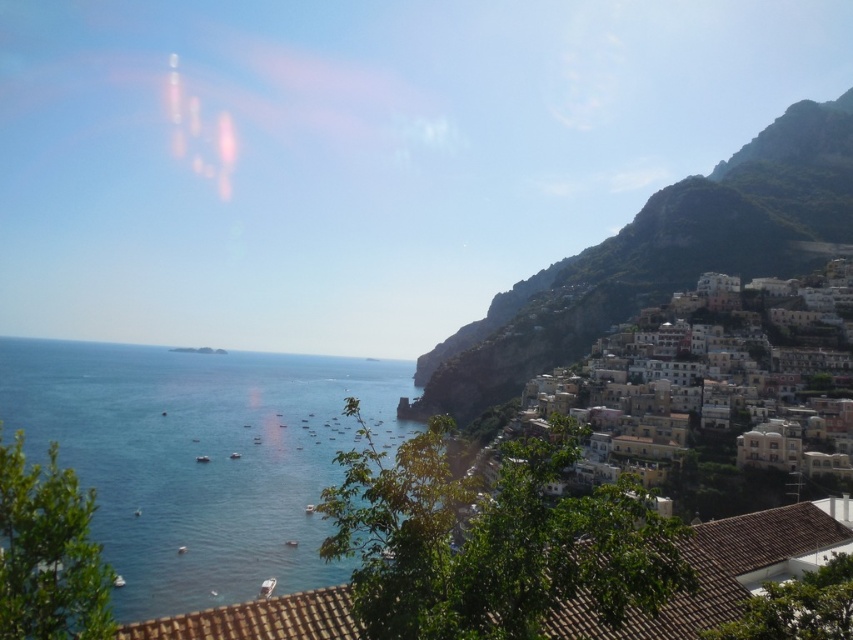
You are standing at the top of the cliff overlooking the coastal town. You see the blue water at center and the white stucco buildings at right. Which one appears closer to you in the scene?

The white stucco buildings at right appear closer because they are taller than the blue water at center in the scene.

You are standing on a cliff overlooking the coastal town and sea. You notice two points in the scene. The first point is at coordinate location point (471, 374) and the second point is at point (831, 365). Which point is closer to you?

Point (471, 374) is closer to you because it is further to the viewer than point (831, 365).

You are standing at a viewpoint overlooking the coastal town and sea. You notice two points in the scene, one at coordinate point (212, 589) and another at point (752, 214). Which point is closer to your current position?

Point (212, 589) is closer to the camera than point (752, 214), so the point at coordinate point (212, 589) is closer to your current position.